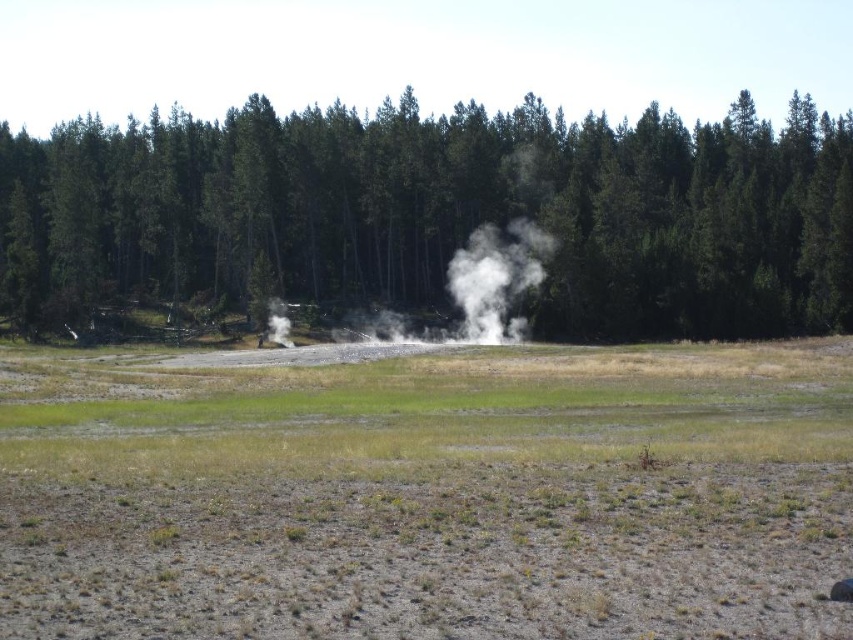
Who is more distant from viewer, (178,424) or (767,308)?

The point (767,308) is behind.

What do you see at coordinates (428, 493) in the screenshot?
I see `dried grass at center` at bounding box center [428, 493].

This screenshot has height=640, width=853. Find the location of `dried grass at center`. dried grass at center is located at coordinates (428, 493).

Is green textured trees at center wider than white vapor at center?

Yes, green textured trees at center is wider than white vapor at center.

Can you confirm if green textured trees at center is shorter than white vapor at center?

No.

Is point (659, 113) farther from viewer compared to point (532, 284)?

Yes, it is behind point (532, 284).

The image size is (853, 640). What are the coordinates of `green textured trees at center` in the screenshot? It's located at (439, 214).

Does dried grass at center appear under white vapor at center?

Correct, dried grass at center is located below white vapor at center.

Which of these two, dried grass at center or white vapor at center, stands taller?

With more height is white vapor at center.

The image size is (853, 640). I want to click on dried grass at center, so coord(428,493).